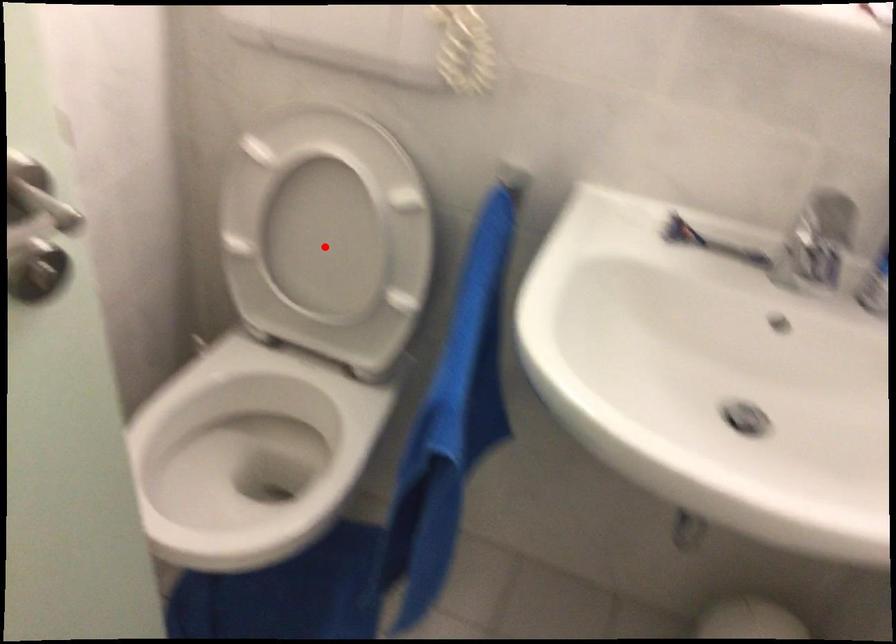
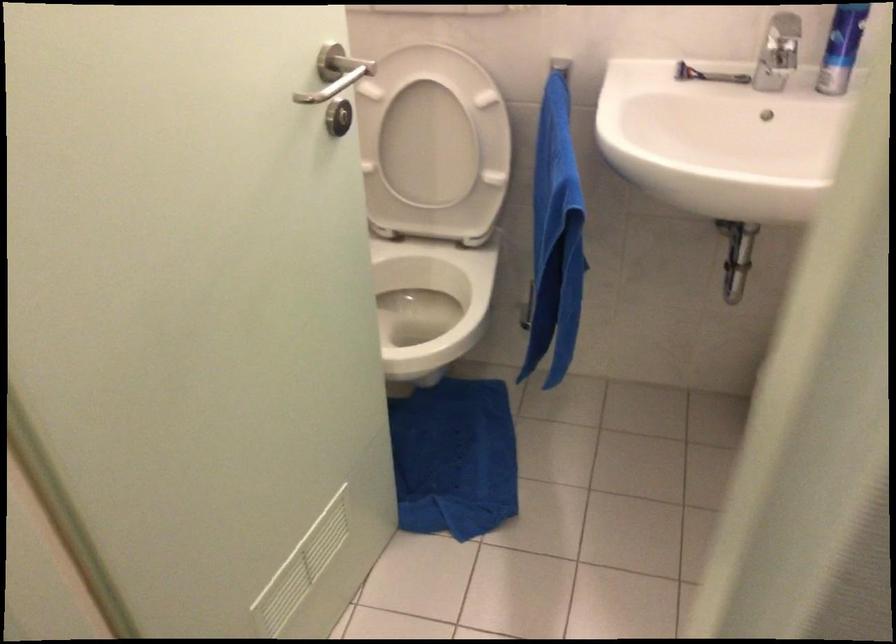
In the second image, find the point that corresponds to the highlighted location in the first image.

(424, 149)